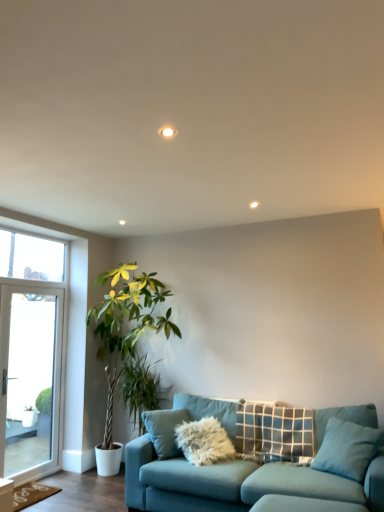
Question: In terms of width, does teal fabric couch at lower center look wider or thinner when compared to transparent glass window at left?

Choices:
 (A) wide
 (B) thin

Answer: (A)

Question: From a real-world perspective, is teal fabric couch at lower center physically located above or below transparent glass window at left?

Choices:
 (A) above
 (B) below

Answer: (B)

Question: Based on their relative distances, which object is farther from the green leafy plant at left?

Choices:
 (A) blue fabric pillow at lower right, which appears as the first pillow when viewed from the front
 (B) green leafy plant at left
 (C) plaid fabric pillow at center, marked as the first pillow in a back-to-front arrangement
 (D) clear glass door at left
 (E) transparent glass window at left

Answer: (A)

Question: Which object is positioned farthest from the transparent glass window at left?

Choices:
 (A) green leafy plant at left
 (B) clear glass door at left
 (C) teal fabric couch at lower center
 (D) plaid fabric pillow at center, marked as the first pillow in a back-to-front arrangement
 (E) green leafy plant at left

Answer: (D)